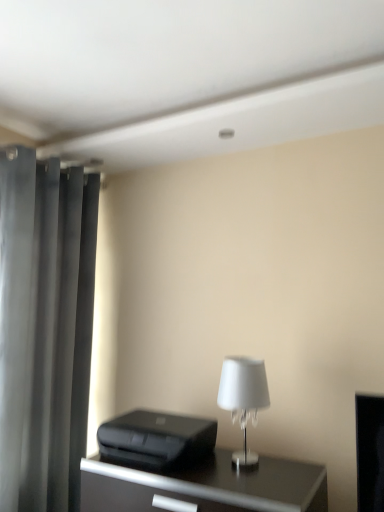
Question: Is black glossy table at center not inside black plastic printer at lower center?

Choices:
 (A) yes
 (B) no

Answer: (A)

Question: Is black glossy table at center at the right side of black plastic printer at lower center?

Choices:
 (A) yes
 (B) no

Answer: (A)

Question: Is there a large distance between black glossy table at center and black plastic printer at lower center?

Choices:
 (A) no
 (B) yes

Answer: (A)

Question: Is black glossy table at center facing away from black plastic printer at lower center?

Choices:
 (A) yes
 (B) no

Answer: (B)

Question: From a real-world perspective, is black glossy table at center over black plastic printer at lower center?

Choices:
 (A) no
 (B) yes

Answer: (A)

Question: Is black glossy table at center closer to camera compared to black plastic printer at lower center?

Choices:
 (A) no
 (B) yes

Answer: (B)

Question: From the image's perspective, is black plastic printer at lower center on top of dark gray matte curtain at left?

Choices:
 (A) yes
 (B) no

Answer: (B)

Question: Does black plastic printer at lower center come behind dark gray matte curtain at left?

Choices:
 (A) yes
 (B) no

Answer: (B)

Question: Considering the relative positions of black plastic printer at lower center and dark gray matte curtain at left in the image provided, is black plastic printer at lower center to the right of dark gray matte curtain at left from the viewer's perspective?

Choices:
 (A) no
 (B) yes

Answer: (B)

Question: Can you confirm if black plastic printer at lower center is bigger than dark gray matte curtain at left?

Choices:
 (A) yes
 (B) no

Answer: (B)

Question: Is dark gray matte curtain at left located within black plastic printer at lower center?

Choices:
 (A) no
 (B) yes

Answer: (A)

Question: Is black plastic printer at lower center located outside dark gray matte curtain at left?

Choices:
 (A) yes
 (B) no

Answer: (A)

Question: Is dark gray matte curtain at left located outside black plastic printer at lower center?

Choices:
 (A) yes
 (B) no

Answer: (A)